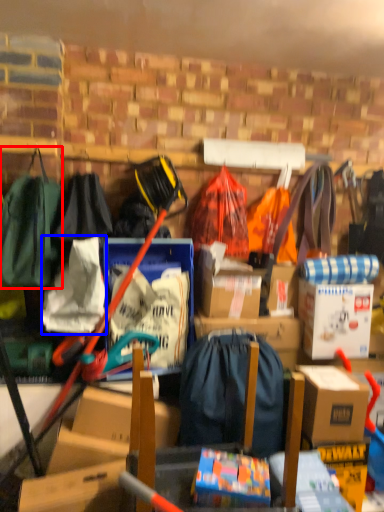
Question: Among these objects, which one is farthest to the camera, clothing (highlighted by a red box) or clothing (highlighted by a blue box)?

Choices:
 (A) clothing
 (B) clothing

Answer: (B)